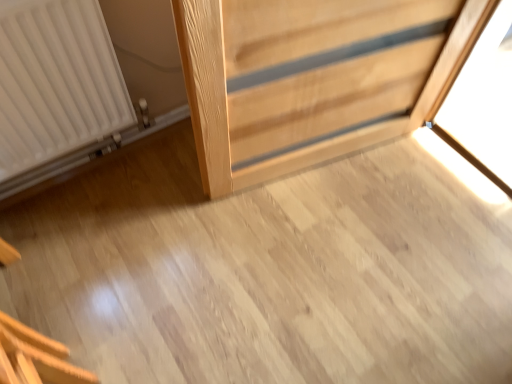
Where is `vacant point to the right of white textured radiator at lower left`? The width and height of the screenshot is (512, 384). vacant point to the right of white textured radiator at lower left is located at coordinates (199, 214).